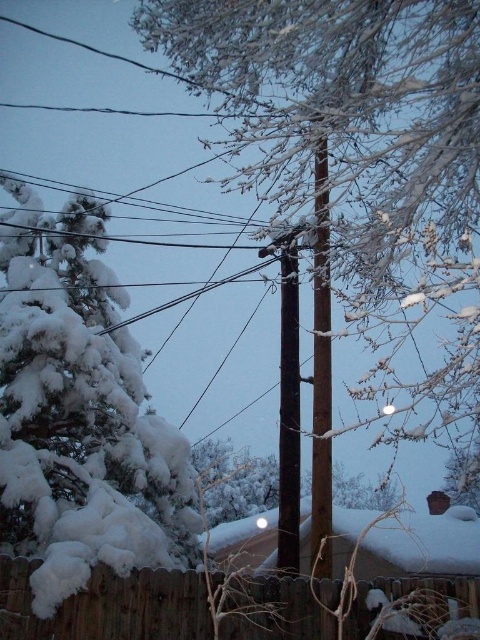
Who is taller, white fluffy tree at left or brown wood telegraph pole at center?

With more height is white fluffy tree at left.

You are a GUI agent. You are given a task and a screenshot of the screen. Output one action in this format:
    pyautogui.click(x=<x>, y=<y>)
    Task: Click on the white fluffy tree at left
    
    Given the screenshot: What is the action you would take?
    pyautogui.click(x=79, y=412)

Is point (108, 280) behind point (315, 420)?

Yes, point (108, 280) is behind point (315, 420).

What are the coordinates of `white fluffy tree at left` in the screenshot? It's located at (79, 412).

Is wooden fence at lower center taller than brown wooden telegraph pole at center?

No, wooden fence at lower center is not taller than brown wooden telegraph pole at center.

Who is positioned more to the left, wooden fence at lower center or brown wooden telegraph pole at center?

wooden fence at lower center is more to the left.

Which is in front, point (354, 624) or point (297, 323)?

Point (354, 624)

The height and width of the screenshot is (640, 480). Identify the location of wooden fence at lower center. (108, 605).

Does snow-covered pine tree at left lie behind brown wooden telegraph pole at center?

No, it is in front of brown wooden telegraph pole at center.

Between point (370, 228) and point (291, 237), which one is positioned in front?

Point (370, 228) is more forward.

Identify the location of snow-covered pine tree at left. (360, 156).